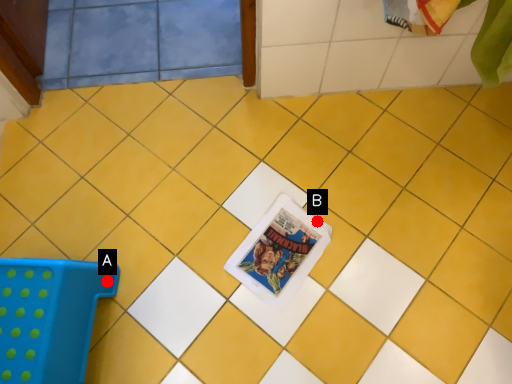
Question: Two points are circled on the image, labeled by A and B beside each circle. Which point appears closest to the camera in this image?

Choices:
 (A) A is closer
 (B) B is closer

Answer: (A)